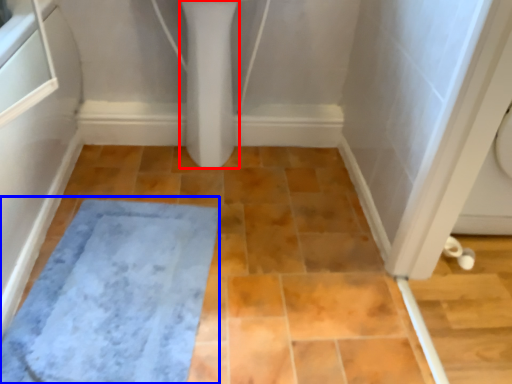
Question: Which of the following is the closest to the observer, bidet (highlighted by a red box) or bath mat (highlighted by a blue box)?

Choices:
 (A) bidet
 (B) bath mat

Answer: (B)